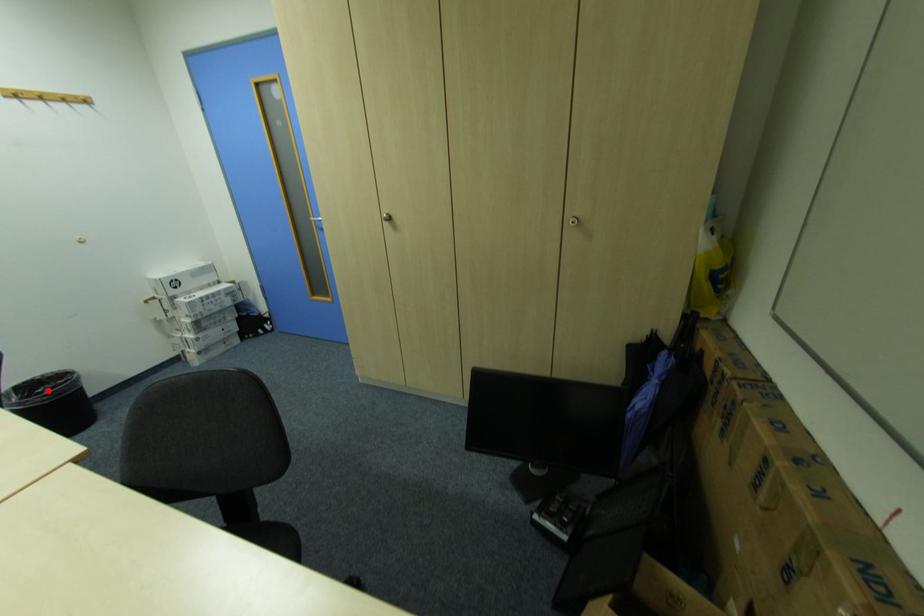
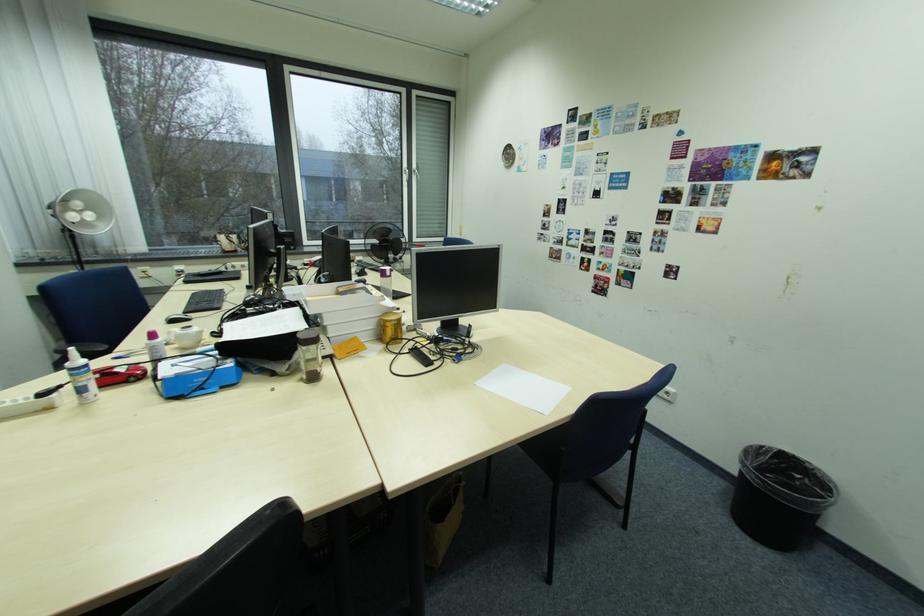
The point at the highlighted location is marked in the first image. Where is the corresponding point in the second image?

(807, 477)